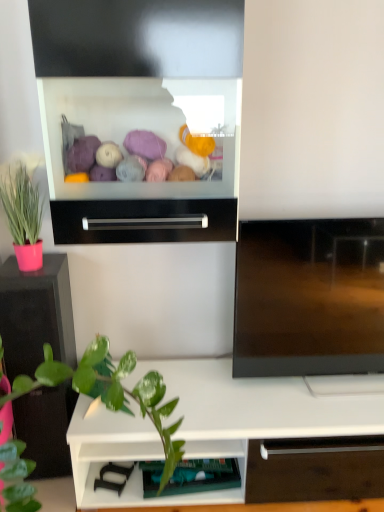
The image size is (384, 512). Find the location of `blank space situated above black metallic drawer at center (from a real-world perspective)`. blank space situated above black metallic drawer at center (from a real-world perspective) is located at coordinates (139, 193).